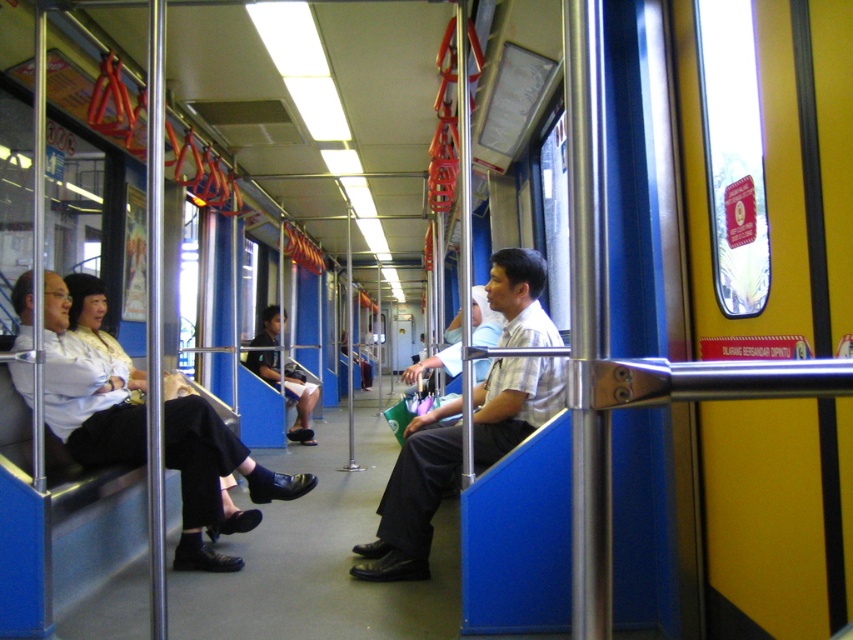
In the scene shown: Does matte white shirt at left have a lesser height compared to light brown fabric shirt at center?

Indeed, matte white shirt at left has a lesser height compared to light brown fabric shirt at center.

This screenshot has width=853, height=640. I want to click on matte white shirt at left, so click(x=86, y=392).

Which of these two, matte white shirt at left or dark blue fabric skirt at center, stands shorter?

matte white shirt at left

Does matte white shirt at left appear on the right side of dark blue fabric skirt at center?

Indeed, matte white shirt at left is positioned on the right side of dark blue fabric skirt at center.

Which is in front, point (178, 426) or point (286, 433)?

Point (178, 426) is in front.

You are a GUI agent. You are given a task and a screenshot of the screen. Output one action in this format:
    pyautogui.click(x=<x>, y=<y>)
    Task: Click on the matte white shirt at left
    
    Given the screenshot: What is the action you would take?
    pyautogui.click(x=86, y=392)

Does light brown fabric shirt at center appear over dark blue fabric skirt at center?

Correct, light brown fabric shirt at center is located above dark blue fabric skirt at center.

Between light brown fabric shirt at center and dark blue fabric skirt at center, which one is positioned higher?

light brown fabric shirt at center

Where is `light brown fabric shirt at center`? light brown fabric shirt at center is located at coordinates (412, 499).

Locate an element on the screen. light brown fabric shirt at center is located at coordinates (412, 499).